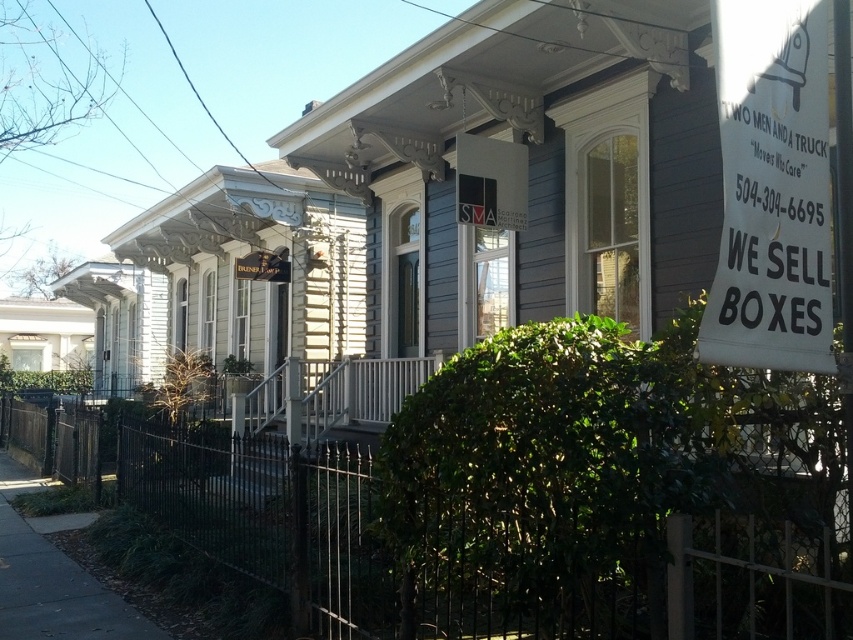
You are a delivery person approaching the house and need to find the entrance. You see the white paper sign at right and the dark gray asphalt at lower left. Which object is closer to the entrance?

The white paper sign at right is closer to the entrance because it is located to the right of the dark gray asphalt at lower left, which is further away from the entrance.

You are standing in front of the house and notice two points marked on the image. The first point is located at coordinates point (805, 129) and the second at point (26, 561). Which point is closer to you?

Point (805, 129) is closer to the viewer than point (26, 561).

You are standing in front of the house and want to read the white paper sign at right. Can you see the dark gray asphalt at lower left behind the sign?

The white paper sign at right is closer to the viewer than dark gray asphalt at lower left, so you cannot see the dark gray asphalt at lower left behind the sign.